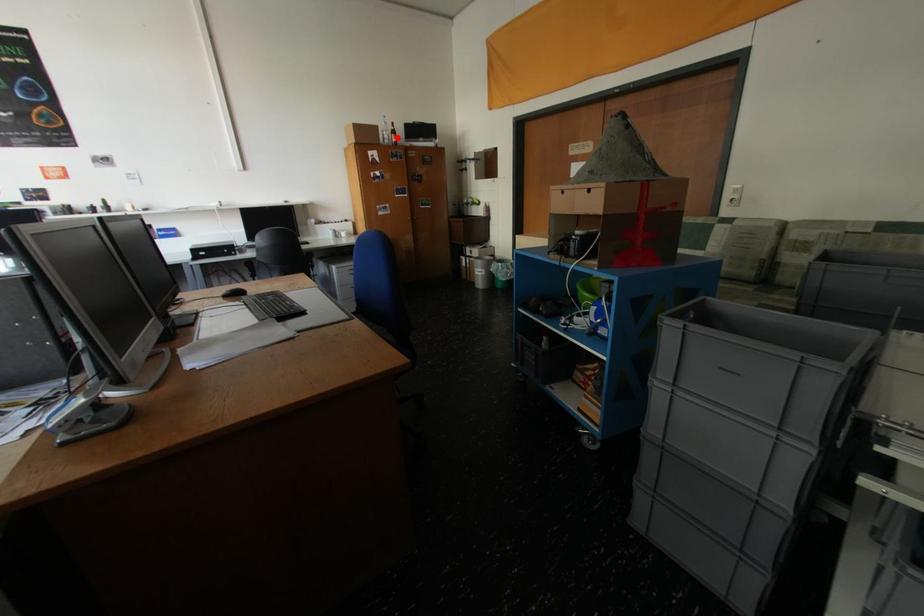
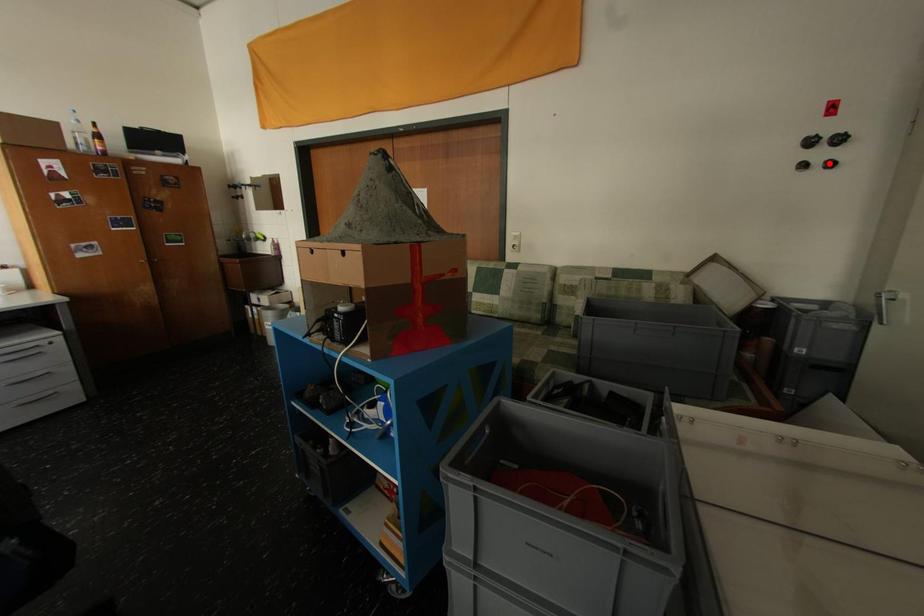
I am providing you with two images of the same scene from different viewpoints. A red point is marked on the first image and another point is marked on the second image. Do the highlighted points in image1 and image2 indicate the same real-world spot?

No